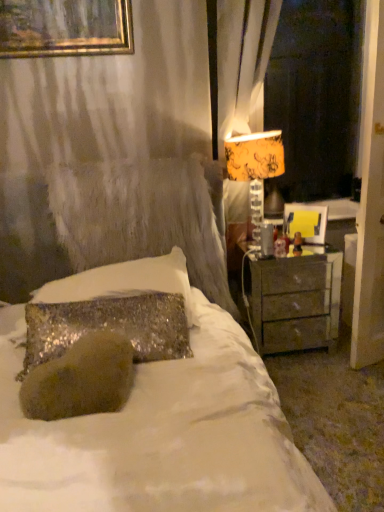
Question: Is sparkly silver pillow at center to the left of matte gray nightstand at right from the viewer's perspective?

Choices:
 (A) no
 (B) yes

Answer: (B)

Question: From a real-world perspective, is sparkly silver pillow at center located higher than matte gray nightstand at right?

Choices:
 (A) no
 (B) yes

Answer: (B)

Question: Is sparkly silver pillow at center further to camera compared to matte gray nightstand at right?

Choices:
 (A) no
 (B) yes

Answer: (A)

Question: Is sparkly silver pillow at center facing towards matte gray nightstand at right?

Choices:
 (A) no
 (B) yes

Answer: (A)

Question: From the image's perspective, is sparkly silver pillow at center located above matte gray nightstand at right?

Choices:
 (A) no
 (B) yes

Answer: (B)

Question: From the image's perspective, is matte gray nightstand at right positioned above or below yellow fabric lampshade at upper right?

Choices:
 (A) below
 (B) above

Answer: (A)

Question: Is matte gray nightstand at right to the left or to the right of yellow fabric lampshade at upper right in the image?

Choices:
 (A) right
 (B) left

Answer: (A)

Question: Looking at their shapes, would you say matte gray nightstand at right is wider or thinner than yellow fabric lampshade at upper right?

Choices:
 (A) wide
 (B) thin

Answer: (A)

Question: From their relative heights in the image, would you say matte gray nightstand at right is taller or shorter than yellow fabric lampshade at upper right?

Choices:
 (A) short
 (B) tall

Answer: (A)

Question: Is sparkly silver pillow at center bigger or smaller than matte yellow lampshade at right?

Choices:
 (A) big
 (B) small

Answer: (B)

Question: From a real-world perspective, is sparkly silver pillow at center above or below matte yellow lampshade at right?

Choices:
 (A) above
 (B) below

Answer: (B)

Question: Considering the positions of sparkly silver pillow at center and matte yellow lampshade at right in the image, is sparkly silver pillow at center wider or thinner than matte yellow lampshade at right?

Choices:
 (A) thin
 (B) wide

Answer: (B)

Question: In the image, is sparkly silver pillow at center positioned in front of or behind matte yellow lampshade at right?

Choices:
 (A) front
 (B) behind

Answer: (A)

Question: From their relative heights in the image, would you say yellow fabric lampshade at upper right is taller or shorter than matte yellow lampshade at right?

Choices:
 (A) short
 (B) tall

Answer: (A)

Question: From a real-world perspective, is yellow fabric lampshade at upper right physically located above or below matte yellow lampshade at right?

Choices:
 (A) below
 (B) above

Answer: (A)